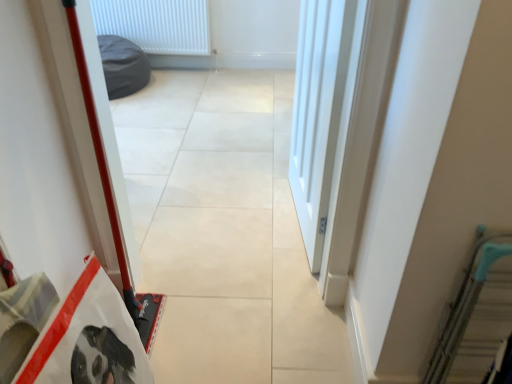
Question: From the image's perspective, is beige tile floor at center located above teal metallic escalator at right?

Choices:
 (A) yes
 (B) no

Answer: (A)

Question: Is beige tile floor at center not within teal metallic escalator at right?

Choices:
 (A) no
 (B) yes

Answer: (B)

Question: Is beige tile floor at center turned away from teal metallic escalator at right?

Choices:
 (A) yes
 (B) no

Answer: (B)

Question: Is beige tile floor at center at the right side of teal metallic escalator at right?

Choices:
 (A) yes
 (B) no

Answer: (B)

Question: Can you confirm if beige tile floor at center is smaller than teal metallic escalator at right?

Choices:
 (A) yes
 (B) no

Answer: (B)

Question: Does beige tile floor at center have a greater height compared to teal metallic escalator at right?

Choices:
 (A) no
 (B) yes

Answer: (B)

Question: From a real-world perspective, is white smooth door at center located beneath teal metallic escalator at right?

Choices:
 (A) no
 (B) yes

Answer: (A)

Question: Is white smooth door at center beside teal metallic escalator at right?

Choices:
 (A) yes
 (B) no

Answer: (B)

Question: Is teal metallic escalator at right completely or partially inside white smooth door at center?

Choices:
 (A) yes
 (B) no

Answer: (B)

Question: Is white smooth door at center not close to teal metallic escalator at right?

Choices:
 (A) no
 (B) yes

Answer: (A)

Question: From the image's perspective, is white smooth door at center above teal metallic escalator at right?

Choices:
 (A) yes
 (B) no

Answer: (A)

Question: Can you confirm if white smooth door at center is taller than teal metallic escalator at right?

Choices:
 (A) yes
 (B) no

Answer: (A)

Question: Can you confirm if white plastic radiator at upper center is smaller than beige tile floor at center?

Choices:
 (A) no
 (B) yes

Answer: (B)